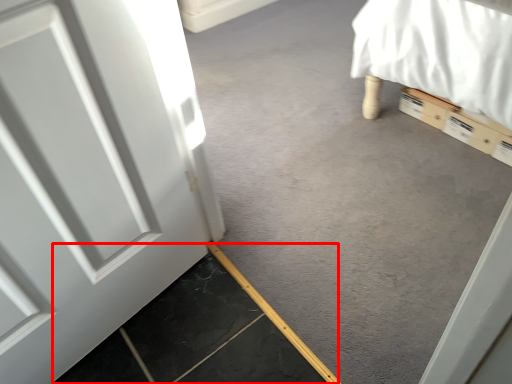
Question: From the image's perspective, what is the correct spatial relationship of concrete (annotated by the red box) in relation to concrete?

Choices:
 (A) below
 (B) above

Answer: (A)